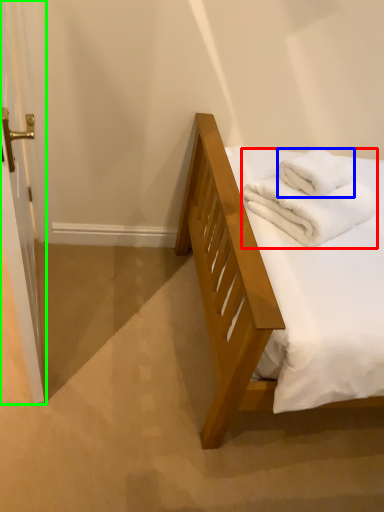
Question: Based on their relative distances, which object is farther from bath towel (highlighted by a red box)? Choose from bath towel (highlighted by a blue box) and screen door (highlighted by a green box).

Choices:
 (A) bath towel
 (B) screen door

Answer: (B)